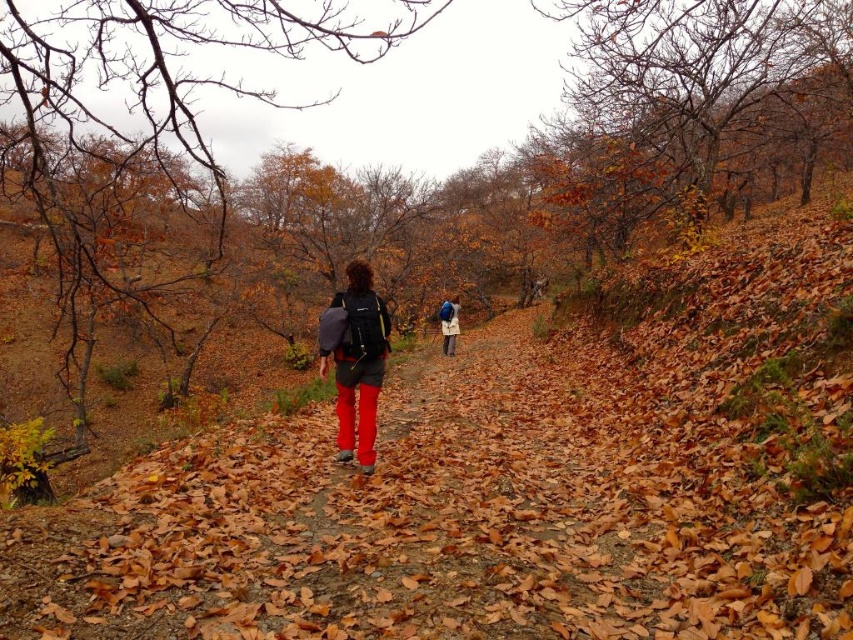
Question: Which of the following is the closest to the observer?

Choices:
 (A) blue fabric backpack at center
 (B) matte black backpack at center

Answer: (B)

Question: Among these points, which one is farthest from the camera?

Choices:
 (A) (361, 465)
 (B) (444, 353)

Answer: (B)

Question: Is matte black backpack at center bigger than blue fabric backpack at center?

Choices:
 (A) yes
 (B) no

Answer: (A)

Question: Is matte black backpack at center smaller than blue fabric backpack at center?

Choices:
 (A) no
 (B) yes

Answer: (A)

Question: Which point is farther to the camera?

Choices:
 (A) matte black backpack at center
 (B) blue fabric backpack at center

Answer: (B)

Question: Can you confirm if matte black backpack at center is wider than blue fabric backpack at center?

Choices:
 (A) yes
 (B) no

Answer: (A)